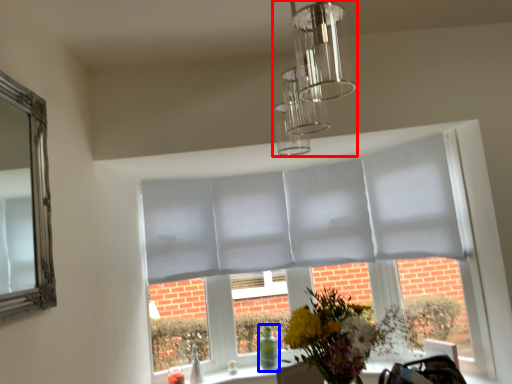
Question: Which object is further to the camera taking this photo, light fixture (highlighted by a red box) or glass vase (highlighted by a blue box)?

Choices:
 (A) light fixture
 (B) glass vase

Answer: (B)